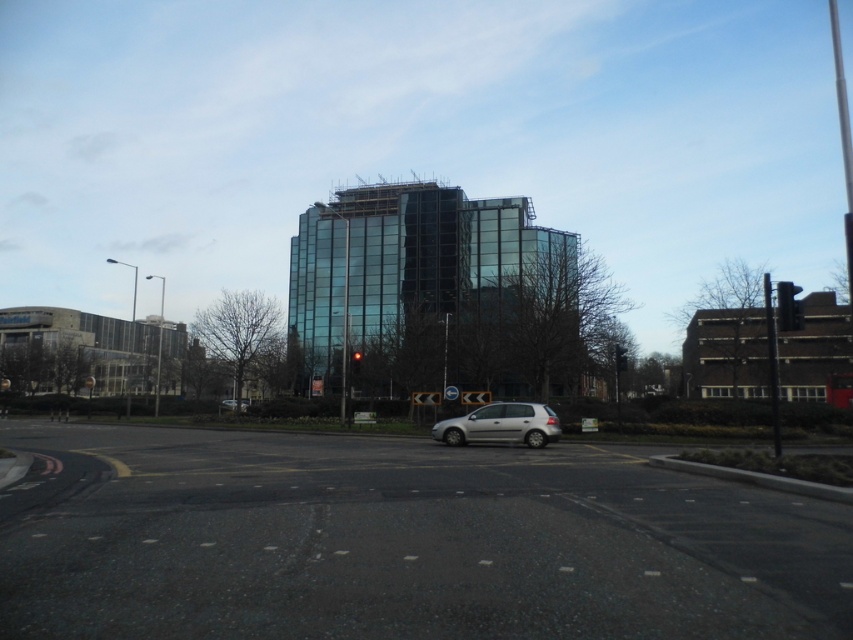
Measure the distance between point (796, 317) and camera.

Point (796, 317) and camera are 13.36 meters apart.

Describe the element at coordinates (788, 307) in the screenshot. I see `black plastic traffic light at right` at that location.

Which is in front, point (788, 312) or point (244, 408)?

Point (788, 312) is more forward.

You are a GUI agent. You are given a task and a screenshot of the screen. Output one action in this format:
    pyautogui.click(x=<x>, y=<y>)
    Task: Click on the black plastic traffic light at right
    The height and width of the screenshot is (640, 853).
    Given the screenshot: What is the action you would take?
    pyautogui.click(x=788, y=307)

Who is positioned more to the left, black asphalt at center or metallic traffic light at center?

From the viewer's perspective, black asphalt at center appears more on the left side.

Measure the distance between black asphalt at center and metallic traffic light at center.

They are 17.67 meters apart.

What do you see at coordinates (399, 541) in the screenshot?
I see `black asphalt at center` at bounding box center [399, 541].

The image size is (853, 640). Find the location of `black asphalt at center`. black asphalt at center is located at coordinates [x=399, y=541].

Image resolution: width=853 pixels, height=640 pixels. What are the coordinates of `black asphalt at center` in the screenshot? It's located at (399, 541).

Does point (68, 529) come behind point (352, 364)?

No, (68, 529) is closer to viewer.

At what (x,y) coordinates should I click in order to perform the action: click on black asphalt at center. Please return your answer as a coordinate pair (x, y). Image resolution: width=853 pixels, height=640 pixels. Looking at the image, I should click on (399, 541).